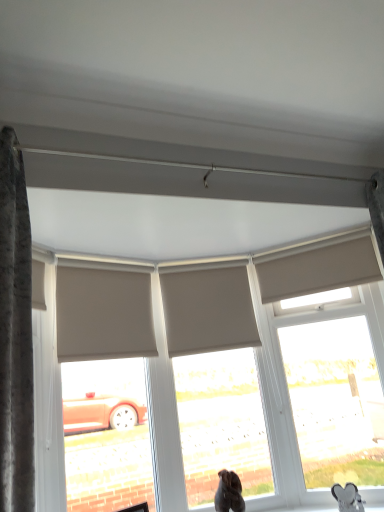
Question: Visually, is metallic silver heart-shaped object at lower right positioned to the left or to the right of beige fabric shutter at center, arranged as the 2th shutter when viewed from the right?

Choices:
 (A) left
 (B) right

Answer: (B)

Question: In terms of width, does metallic silver heart-shaped object at lower right look wider or thinner when compared to beige fabric shutter at center, which is the second shutter from left to right?

Choices:
 (A) wide
 (B) thin

Answer: (A)

Question: Considering the real-world distances, which object is farthest from the metallic silver heart-shaped object at lower right?

Choices:
 (A) beige fabric shutter at center, arranged as the 2th shutter when viewed from the right
 (B) beige fabric roller blind at upper left, which is counted as the 3th shutter, starting from the right
 (C) matte beige window at upper right, which is the 1th window from right to left
 (D) matte gray window at center, which appears as the 2th window when viewed from the right
 (E) beige fabric shutter at upper center, which is the 1th shutter in right-to-left order

Answer: (B)

Question: Which of these objects is positioned farthest from the brown fur dog at lower center?

Choices:
 (A) matte beige window at upper right, the 2th window in the left-to-right sequence
 (B) beige fabric shutter at upper center, the 3th shutter in the left-to-right sequence
 (C) beige fabric shutter at center, arranged as the 2th shutter when viewed from the right
 (D) beige fabric roller blind at upper left, which is counted as the 3th shutter, starting from the right
 (E) matte gray window at center, which appears as the 2th window when viewed from the right

Answer: (B)